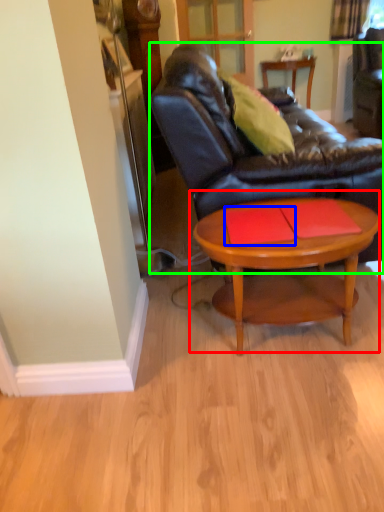
Question: Which object is the farthest from coffee table (highlighted by a red box)? Choose among these: plank (highlighted by a blue box) or studio couch (highlighted by a green box).

Choices:
 (A) plank
 (B) studio couch

Answer: (B)